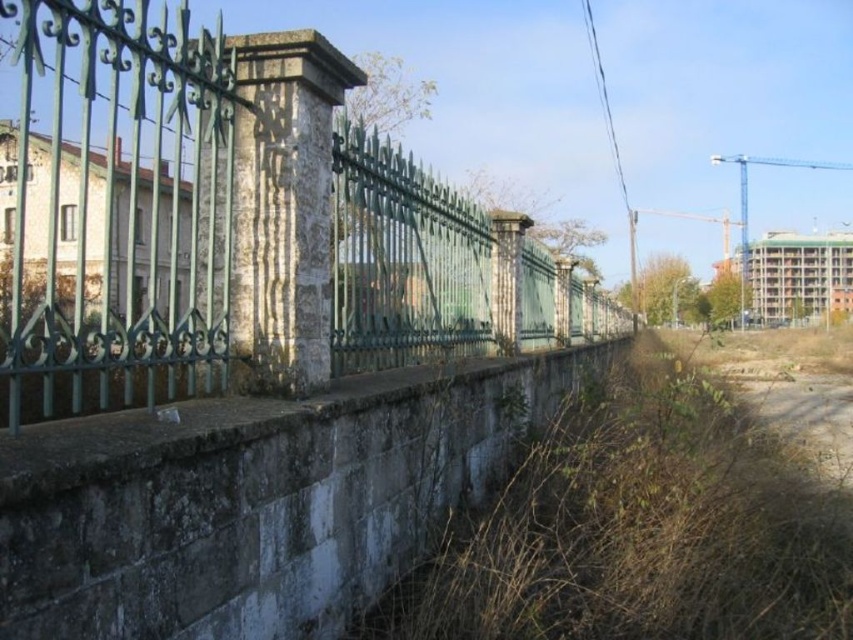
Can you confirm if green wrought iron fence at left is shorter than brown dry grass at lower right?

No, green wrought iron fence at left is not shorter than brown dry grass at lower right.

Is green wrought iron fence at left taller than brown dry grass at lower right?

Yes.

What do you see at coordinates (233, 224) in the screenshot? I see `green wrought iron fence at left` at bounding box center [233, 224].

Find the location of a particular element. green wrought iron fence at left is located at coordinates (233, 224).